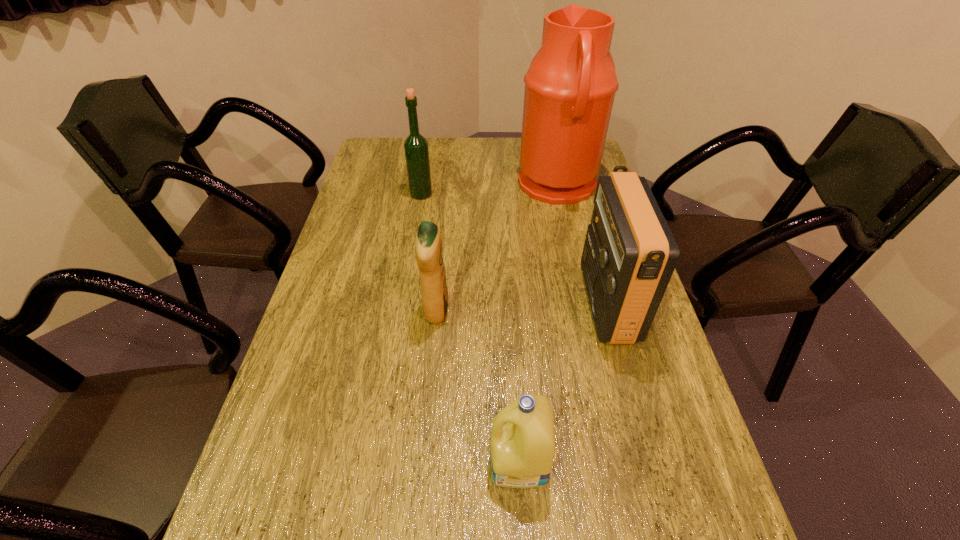
Image resolution: width=960 pixels, height=540 pixels. In order to click on vacant space located 0.130m on the right of the liquor in this screenshot , I will do `click(470, 194)`.

Where is `vacant space located 0.050m on the front-facing side of the radio receiver`? The image size is (960, 540). vacant space located 0.050m on the front-facing side of the radio receiver is located at coordinates (566, 303).

I want to click on free space located 0.110m on the front-facing side of the radio receiver, so click(543, 303).

You are a GUI agent. You are given a task and a screenshot of the screen. Output one action in this format:
    pyautogui.click(x=<x>, y=<y>)
    Task: Click on the vacant space situated on the front-facing side of the radio receiver
    This screenshot has width=960, height=540.
    Given the screenshot: What is the action you would take?
    pyautogui.click(x=467, y=303)

Identify the location of vacant space positioned 0.140m on the label of the left detergent. (504, 311).

Where is `vacant space located 0.140m on the label of the shortest object`? This screenshot has width=960, height=540. vacant space located 0.140m on the label of the shortest object is located at coordinates pyautogui.click(x=418, y=461).

Where is `vacant space situated on the label of the shortest object`? The height and width of the screenshot is (540, 960). vacant space situated on the label of the shortest object is located at coordinates (309, 461).

At what (x,y) coordinates should I click in order to perform the action: click on free location located 0.100m on the label of the shortest object. Please return your answer as a coordinate pair (x, y). Looking at the image, I should click on (439, 461).

You are a GUI agent. You are given a task and a screenshot of the screen. Output one action in this format:
    pyautogui.click(x=<x>, y=<y>)
    Task: Click on the object that is at the far edge
    Image resolution: width=960 pixels, height=540 pixels.
    Given the screenshot: What is the action you would take?
    pyautogui.click(x=570, y=87)

Locate an element on the screen. Image resolution: width=960 pixels, height=540 pixels. water jug situated at the right edge is located at coordinates (570, 87).